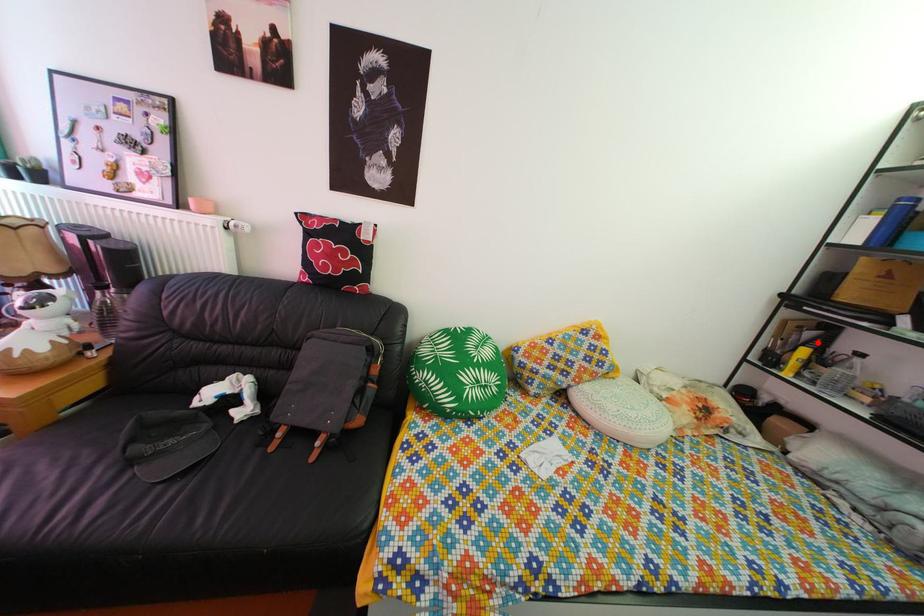
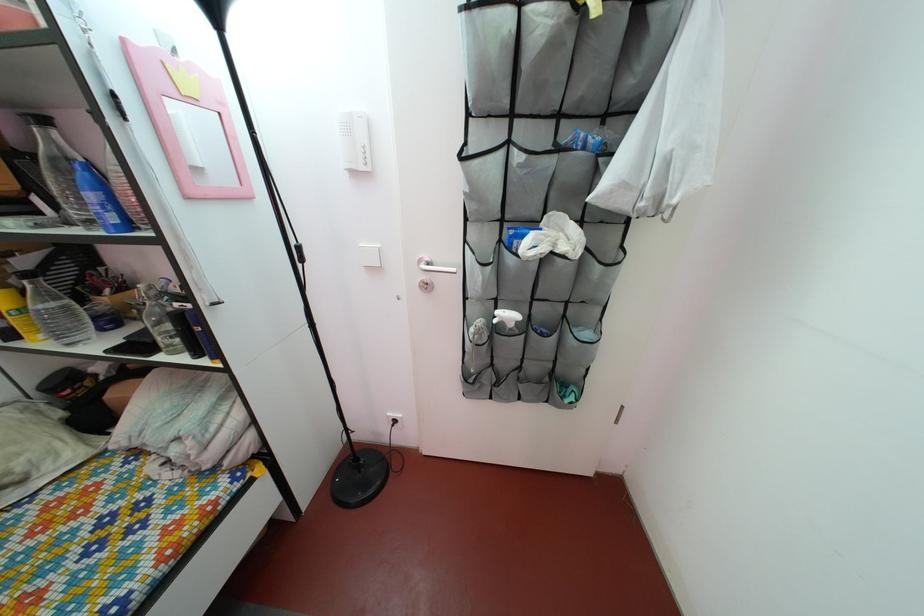
The point at the highlighted location is marked in the first image. Where is the corresponding point in the second image?

(32, 270)